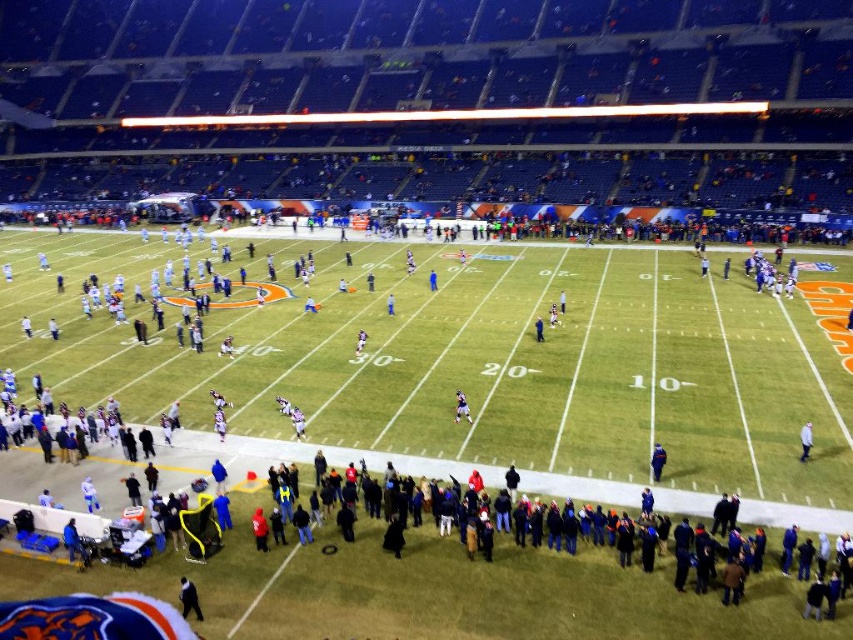
You are a photographer at the stadium and need to capture both the white matte jacket at lower right and the blue fabric jacket at center in a single frame. Which jacket should you focus on to ensure both are visible without zooming in too much?

You should focus on the white matte jacket at lower right because it is bigger than the blue fabric jacket at center, making it easier to include both in the frame without excessive zoom.

You are a spectator at the football stadium, and you want to take a photo of both the black matte jacket at lower center and the white matte jacket at lower right. Based on their positions, which jacket will appear closer to the camera in your photo?

The black matte jacket at lower center will appear closer to the camera because it is positioned in front of the white matte jacket at lower right.

You are a photographer standing at the edge of the football field. You notice two jackets in the scene, the black matte jacket at lower center and the white matte jacket at lower right. Which jacket appears taller in the photo?

The white matte jacket at lower right appears taller than the black matte jacket at lower center.